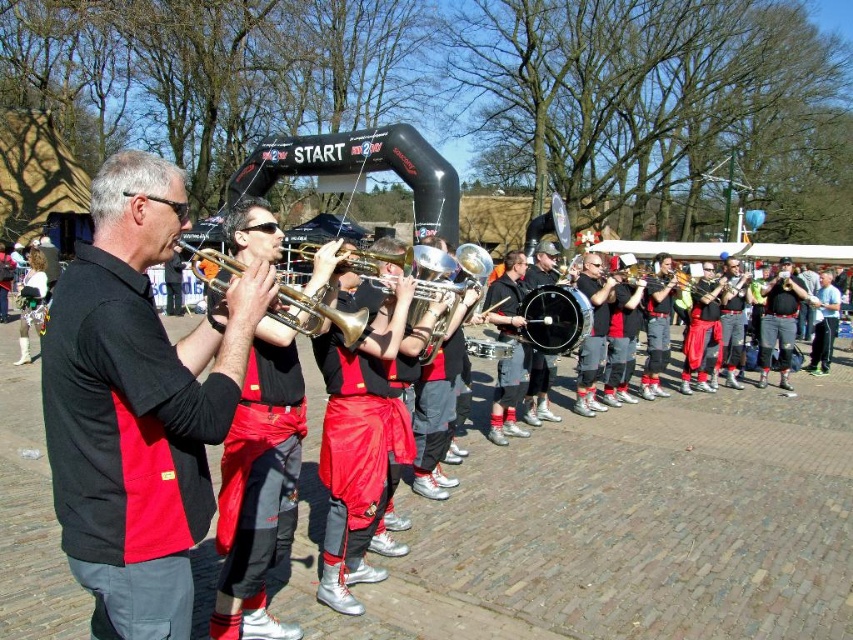
Looking at this image, does matte black shirt at left appear on the right side of gold brass trumpet at center?

In fact, matte black shirt at left is to the left of gold brass trumpet at center.

Does matte black shirt at left have a smaller size compared to gold brass trumpet at center?

No.

Describe the element at coordinates (138, 403) in the screenshot. This screenshot has width=853, height=640. I see `matte black shirt at left` at that location.

Locate an element on the screen. The image size is (853, 640). matte black shirt at left is located at coordinates (138, 403).

You are a GUI agent. You are given a task and a screenshot of the screen. Output one action in this format:
    pyautogui.click(x=<x>, y=<y>)
    Task: Click on the matte black shirt at left
    
    Given the screenshot: What is the action you would take?
    coord(138,403)

Is matte black shirt at left further to the viewer compared to matte black trumpet at left?

No, it is in front of matte black trumpet at left.

Does point (57, 484) lie behind point (235, 566)?

No, it is not.

Find the location of a particular element. The image size is (853, 640). matte black shirt at left is located at coordinates (138, 403).

Describe the element at coordinates (259, 486) in the screenshot. The image size is (853, 640). I see `matte black trumpet at left` at that location.

Can you confirm if matte black trumpet at left is positioned to the right of gold brass trumpet at center?

Yes, matte black trumpet at left is to the right of gold brass trumpet at center.

Where is `matte black trumpet at left`? matte black trumpet at left is located at coordinates (259, 486).